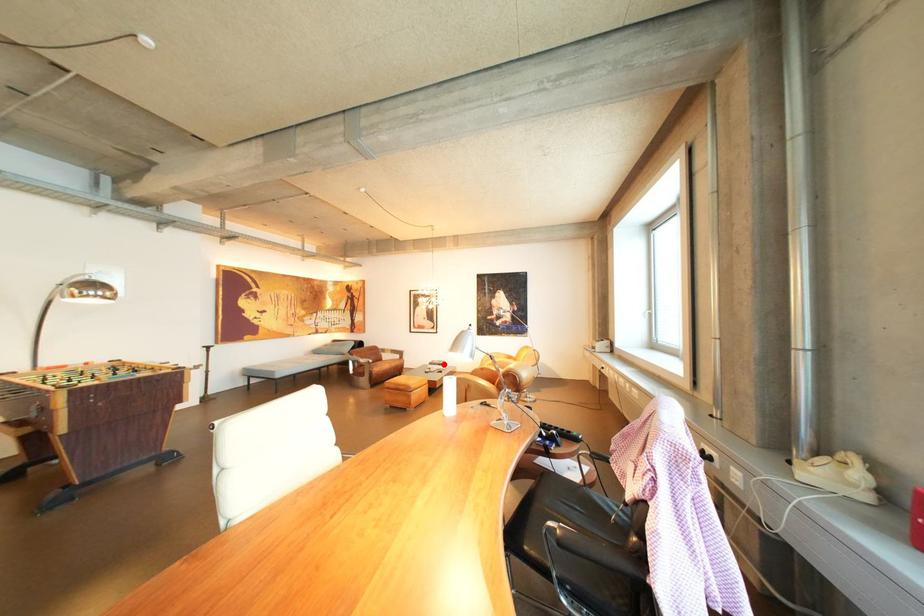
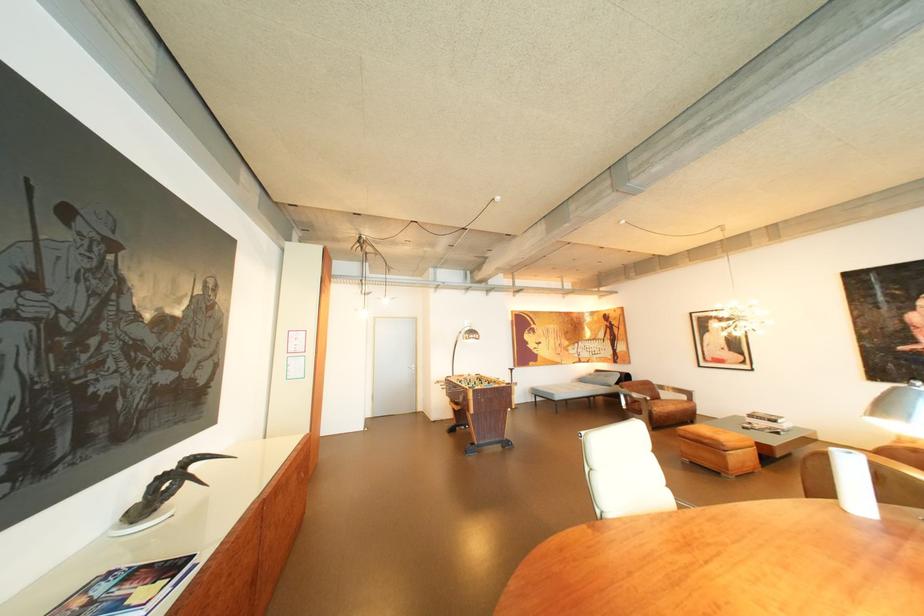
Question: I am providing you with two images of the same scene from different viewpoints. In image1, a red point is highlighted. Considering the same 3D point in image2, which of the following is correct?

Choices:
 (A) It is closer
 (B) It is farther

Answer: (A)